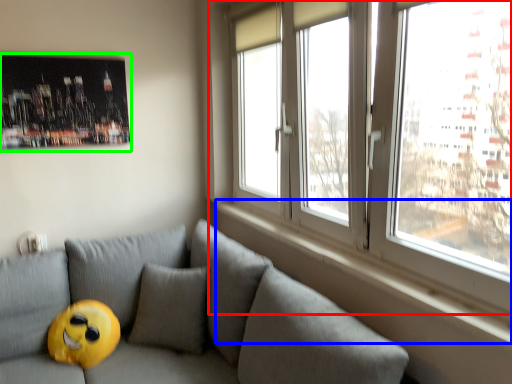
Question: Which is farther away from window (highlighted by a red box)? window sill (highlighted by a blue box) or picture frame (highlighted by a green box)?

Choices:
 (A) window sill
 (B) picture frame

Answer: (B)